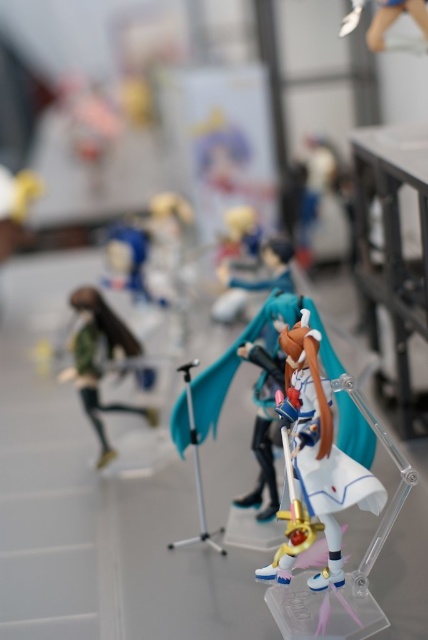
Question: From the image, what is the correct spatial relationship of satin white figurine at center in relation to matte green figure at left?

Choices:
 (A) left
 (B) right

Answer: (B)

Question: Which object is closer to the camera taking this photo?

Choices:
 (A) satin white figurine at center
 (B) matte green figure at left

Answer: (A)

Question: Does satin white figurine at center have a smaller size compared to matte green figure at left?

Choices:
 (A) yes
 (B) no

Answer: (A)

Question: Which of the following is the closest to the observer?

Choices:
 (A) (305, 474)
 (B) (116, 344)

Answer: (A)

Question: Does satin white figurine at center come behind matte green figure at left?

Choices:
 (A) no
 (B) yes

Answer: (A)